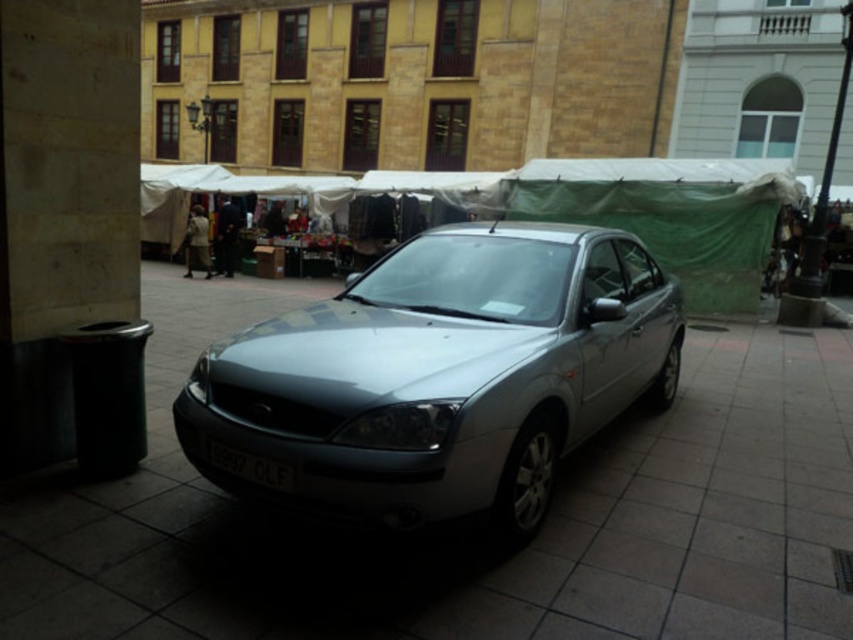
Is slate gray pavement at center above white plastic license plate at center?

Indeed, slate gray pavement at center is positioned over white plastic license plate at center.

Which of these two, slate gray pavement at center or white plastic license plate at center, stands shorter?

Standing shorter between the two is white plastic license plate at center.

Who is more forward, (137, 600) or (259, 474)?

Positioned in front is point (137, 600).

You are a GUI agent. You are given a task and a screenshot of the screen. Output one action in this format:
    pyautogui.click(x=<x>, y=<y>)
    Task: Click on the slate gray pavement at center
    The image size is (853, 640).
    Given the screenshot: What is the action you would take?
    pyautogui.click(x=467, y=545)

Who is more forward, (548,406) or (283,467)?

Point (283,467)

Consider the image. Which is below, satin silver car at center or white plastic license plate at center?

Positioned lower is white plastic license plate at center.

I want to click on satin silver car at center, so click(x=442, y=376).

Consider the image. Can you confirm if slate gray pavement at center is wider than satin silver car at center?

Indeed, slate gray pavement at center has a greater width compared to satin silver car at center.

Does slate gray pavement at center come in front of satin silver car at center?

Yes.

Identify the location of slate gray pavement at center. Image resolution: width=853 pixels, height=640 pixels. (467, 545).

This screenshot has height=640, width=853. I want to click on slate gray pavement at center, so click(x=467, y=545).